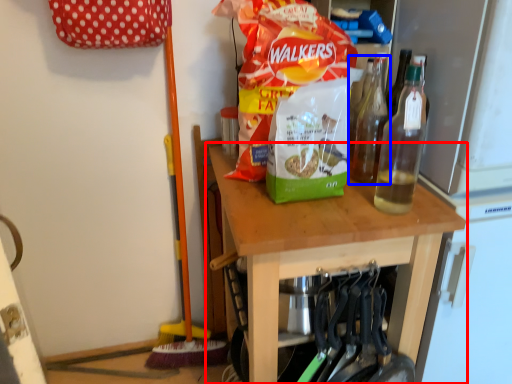
Question: Among these objects, which one is farthest to the camera, table (highlighted by a red box) or bottle (highlighted by a blue box)?

Choices:
 (A) table
 (B) bottle

Answer: (B)